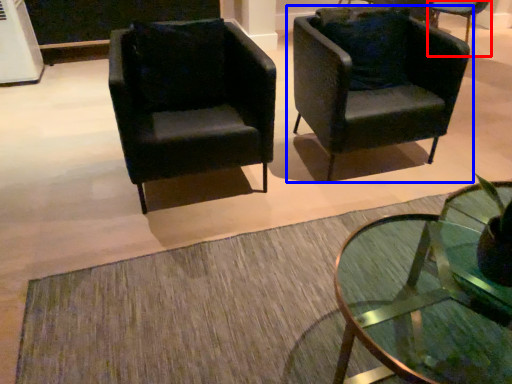
Question: Among these objects, which one is nearest to the camera, chair (highlighted by a red box) or chair (highlighted by a blue box)?

Choices:
 (A) chair
 (B) chair

Answer: (B)